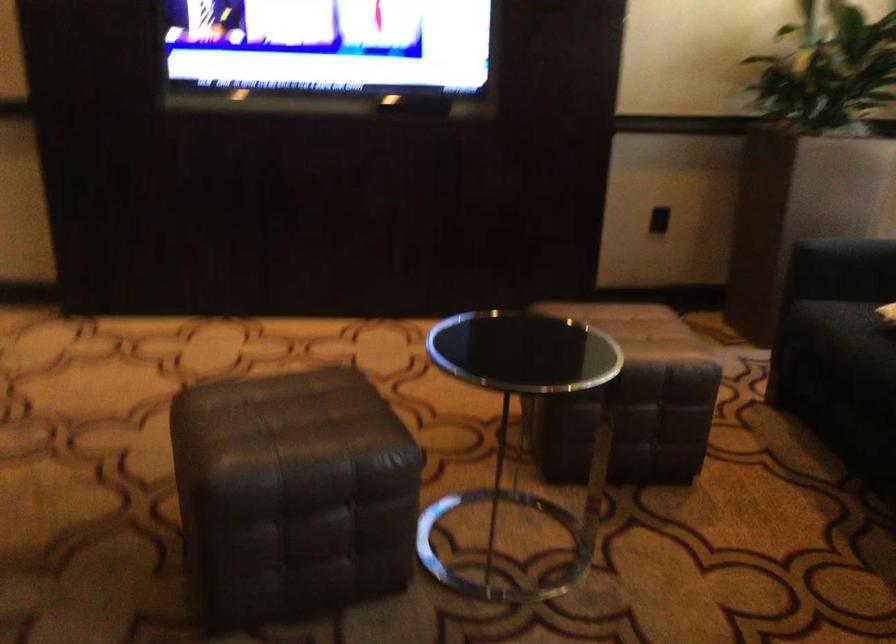
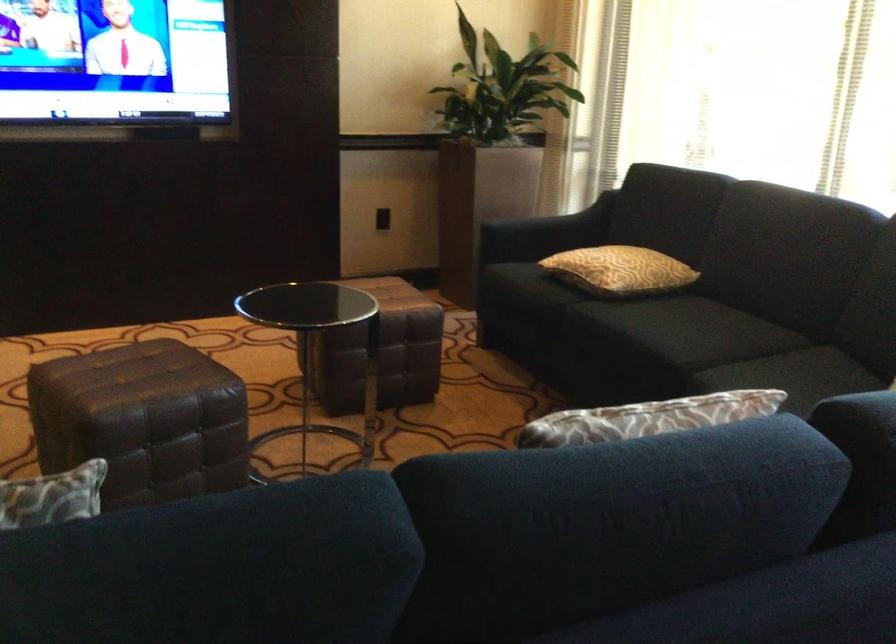
What movement of the cameraman would produce the second image?

The cameraman moved toward left, backward.